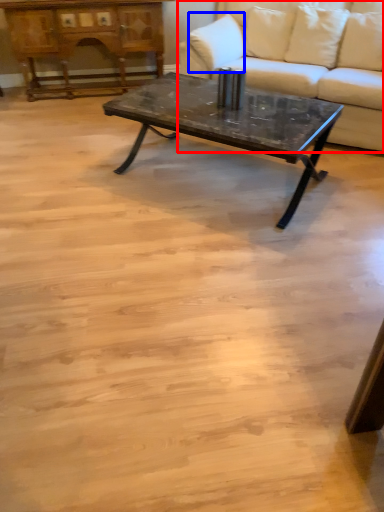
Question: Among these objects, which one is nearest to the camera, studio couch (highlighted by a red box) or pillow (highlighted by a blue box)?

Choices:
 (A) studio couch
 (B) pillow

Answer: (A)